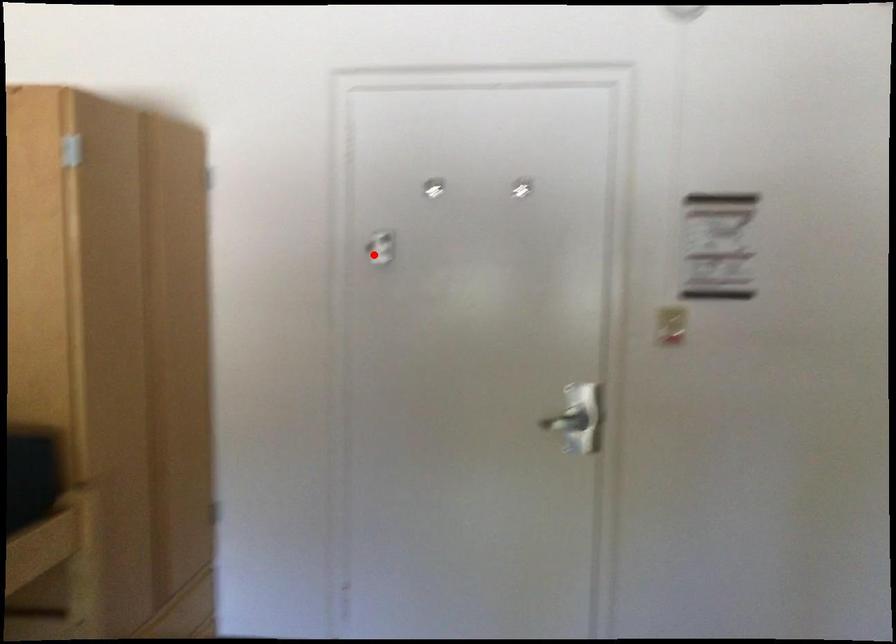
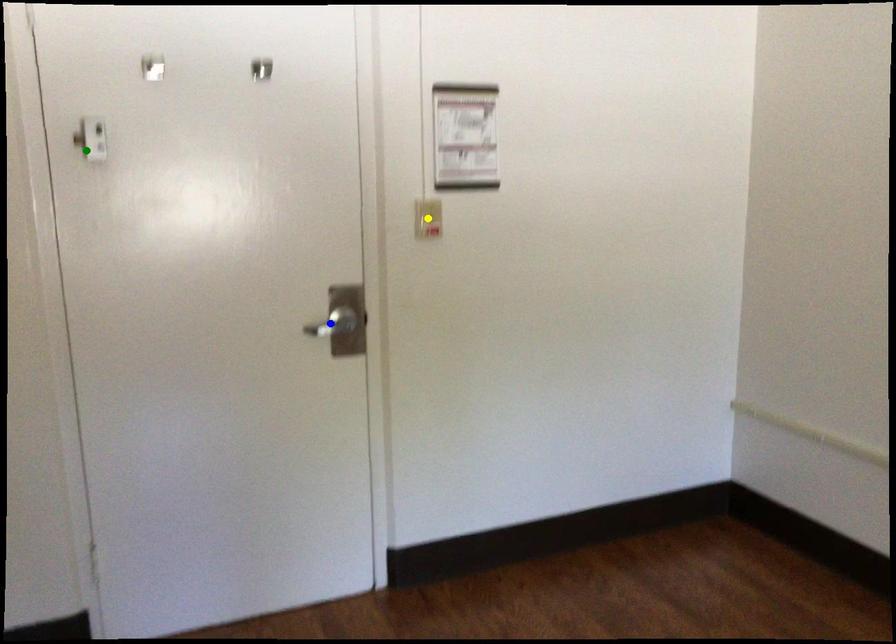
Question: I am providing you with two images of the same scene from different viewpoints. A red point is marked on the first image. You are given multiple points on the second image. Which spot in image 2 lines up with the point in image 1?

Choices:
 (A) blue point
 (B) yellow point
 (C) green point

Answer: (C)